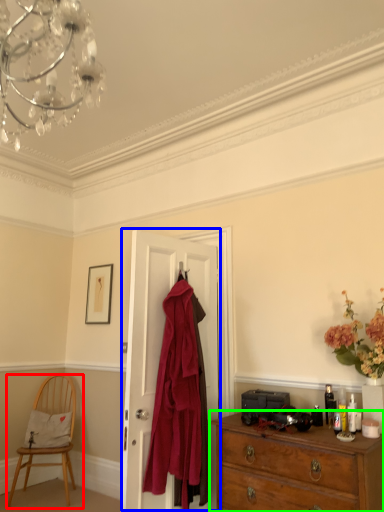
Question: Which object is the closest to the chair (highlighted by a red box)? Choose among these: door (highlighted by a blue box) or chest of drawers (highlighted by a green box).

Choices:
 (A) door
 (B) chest of drawers

Answer: (A)